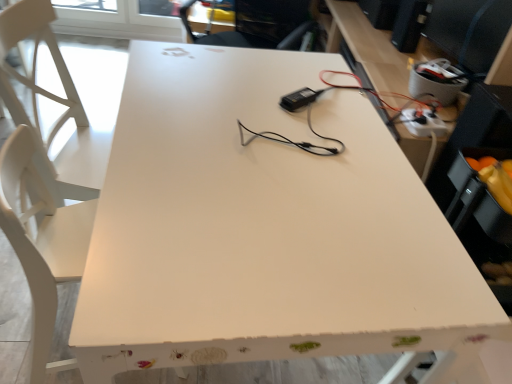
Question: From a real-world perspective, does white glossy computer desk at right stand above white plastic extension cord at upper right?

Choices:
 (A) no
 (B) yes

Answer: (A)

Question: Is white glossy computer desk at right to the right of white plastic extension cord at upper right from the viewer's perspective?

Choices:
 (A) yes
 (B) no

Answer: (A)

Question: Does white glossy computer desk at right contain white plastic extension cord at upper right?

Choices:
 (A) no
 (B) yes

Answer: (B)

Question: Is white glossy computer desk at right further to the viewer compared to white plastic extension cord at upper right?

Choices:
 (A) no
 (B) yes

Answer: (A)

Question: Is white glossy computer desk at right smaller than white plastic extension cord at upper right?

Choices:
 (A) yes
 (B) no

Answer: (B)

Question: From the image's perspective, would you say white glossy computer desk at right is shown under white plastic extension cord at upper right?

Choices:
 (A) yes
 (B) no

Answer: (B)

Question: From a real-world perspective, is white plastic extension cord at upper right physically above white glossy computer desk at right?

Choices:
 (A) yes
 (B) no

Answer: (A)

Question: Considering the relative sizes of white plastic extension cord at upper right and white glossy computer desk at right in the image provided, is white plastic extension cord at upper right bigger than white glossy computer desk at right?

Choices:
 (A) no
 (B) yes

Answer: (A)

Question: From the image's perspective, is white plastic extension cord at upper right on white glossy computer desk at right?

Choices:
 (A) yes
 (B) no

Answer: (B)

Question: Is white plastic extension cord at upper right not near white glossy computer desk at right?

Choices:
 (A) no
 (B) yes

Answer: (A)

Question: Could you tell me if white plastic extension cord at upper right is turned towards white glossy computer desk at right?

Choices:
 (A) no
 (B) yes

Answer: (B)

Question: Is white plastic extension cord at upper right not within white glossy computer desk at right?

Choices:
 (A) yes
 (B) no

Answer: (B)

Question: Considering the positions of white glossy computer desk at right and white plastic extension cord at upper right in the image, is white glossy computer desk at right taller or shorter than white plastic extension cord at upper right?

Choices:
 (A) tall
 (B) short

Answer: (A)